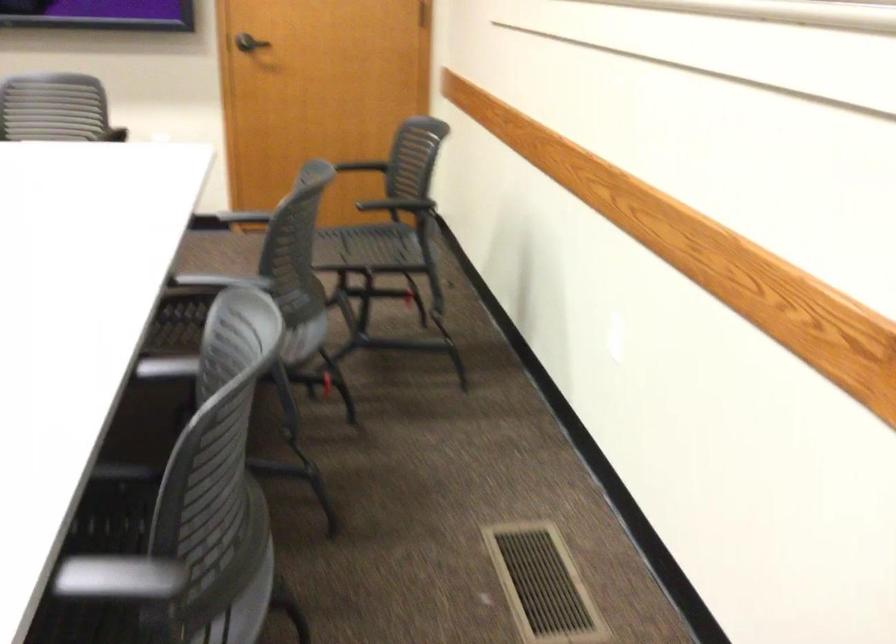
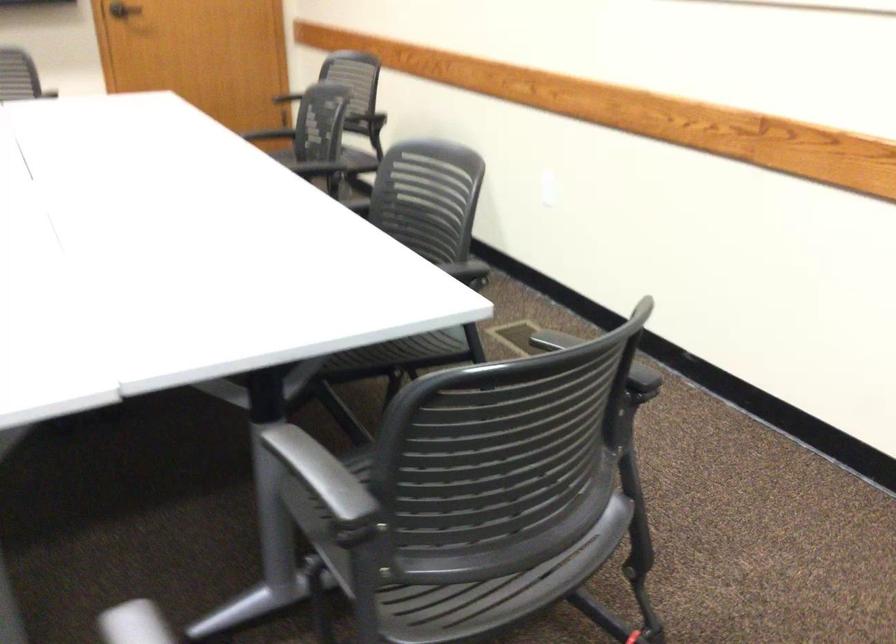
In the second image, find the point that corresponds to point (615, 354) in the first image.

(547, 196)